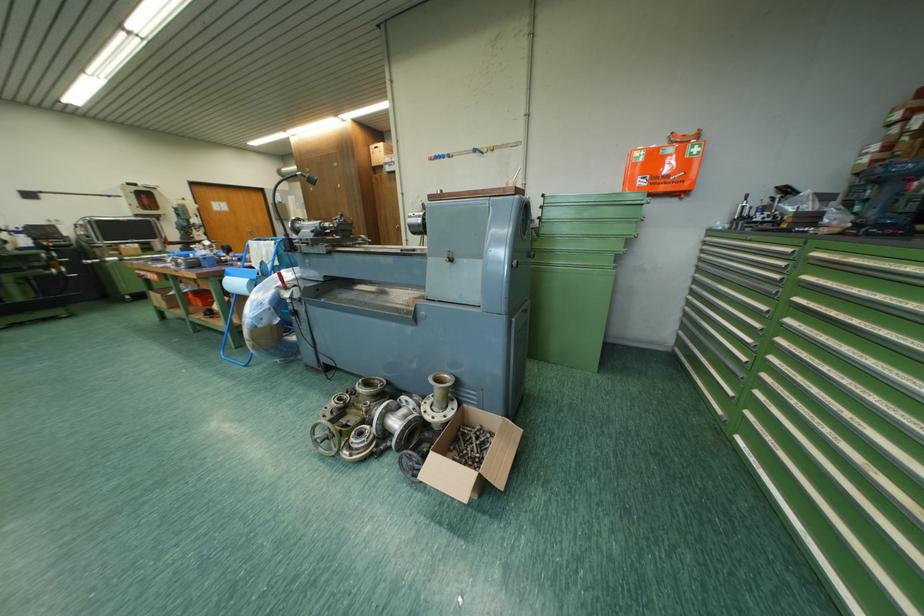
You are a GUI agent. You are given a task and a screenshot of the screen. Output one action in this format:
    pyautogui.click(x=<x>, y=<y>)
    Task: Click on the first-aid kit handle
    The width and height of the screenshot is (924, 616).
    Given the screenshot: What is the action you would take?
    pyautogui.click(x=687, y=190)